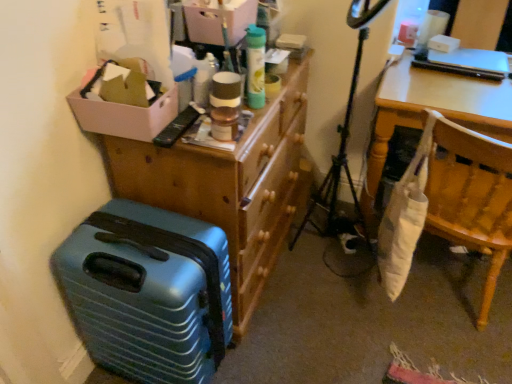
What are the coordinates of `empty space that is ontop of teal matte suitcase at lower left (from a real-world perspective)` in the screenshot? It's located at (142, 236).